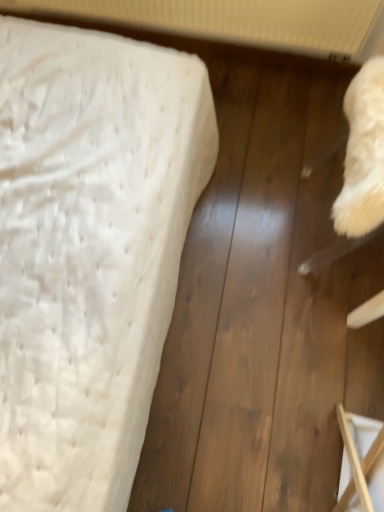
Question: Can you confirm if white textured radiator at upper center is wider than wooden frame at lower right?

Choices:
 (A) yes
 (B) no

Answer: (B)

Question: Is white textured radiator at upper center smaller than wooden frame at lower right?

Choices:
 (A) no
 (B) yes

Answer: (A)

Question: From a real-world perspective, is white textured radiator at upper center located higher than wooden frame at lower right?

Choices:
 (A) yes
 (B) no

Answer: (A)

Question: Considering the relative sizes of white textured radiator at upper center and wooden frame at lower right in the image provided, is white textured radiator at upper center shorter than wooden frame at lower right?

Choices:
 (A) no
 (B) yes

Answer: (B)

Question: From the image's perspective, is white textured radiator at upper center on wooden frame at lower right?

Choices:
 (A) yes
 (B) no

Answer: (A)

Question: Can you confirm if white textured radiator at upper center is bigger than wooden frame at lower right?

Choices:
 (A) yes
 (B) no

Answer: (A)

Question: Does wooden frame at lower right come in front of white textured mattress at left?

Choices:
 (A) no
 (B) yes

Answer: (B)

Question: Is wooden frame at lower right smaller than white textured mattress at left?

Choices:
 (A) no
 (B) yes

Answer: (B)

Question: From the image's perspective, would you say wooden frame at lower right is shown under white textured mattress at left?

Choices:
 (A) yes
 (B) no

Answer: (A)

Question: From a real-world perspective, is wooden frame at lower right physically above white textured mattress at left?

Choices:
 (A) no
 (B) yes

Answer: (B)

Question: From the image's perspective, is wooden frame at lower right on white textured mattress at left?

Choices:
 (A) no
 (B) yes

Answer: (A)

Question: Can you confirm if wooden frame at lower right is bigger than white textured mattress at left?

Choices:
 (A) yes
 (B) no

Answer: (B)

Question: Can you confirm if white textured mattress at left is wider than wooden frame at lower right?

Choices:
 (A) no
 (B) yes

Answer: (B)